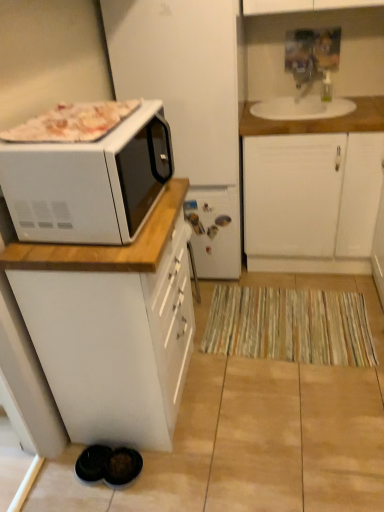
Measure the distance between point (168, 29) and camera.

Point (168, 29) is 6.19 feet from camera.

The image size is (384, 512). What do you see at coordinates (319, 121) in the screenshot?
I see `wooden countertop at upper right` at bounding box center [319, 121].

Measure the distance between point (263, 326) and camera.

Point (263, 326) and camera are 2.20 meters apart from each other.

Describe the element at coordinates (310, 189) in the screenshot. The image size is (384, 512). I see `white matte cabinet at upper right, the second cabinetry from the front` at that location.

Where is `white glossy microwave at upper left`? This screenshot has height=512, width=384. white glossy microwave at upper left is located at coordinates (89, 182).

This screenshot has width=384, height=512. Identify the location of white matte microwave at left. (189, 105).

Could you tell me if striped fabric mat at lower center is facing white matte microwave at left?

No, striped fabric mat at lower center is not facing towards white matte microwave at left.

Is the position of striped fabric mat at lower center more distant than that of white matte microwave at left?

Yes, it is behind white matte microwave at left.

Is striped fabric mat at lower center to the left of white matte microwave at left from the viewer's perspective?

Incorrect, striped fabric mat at lower center is not on the left side of white matte microwave at left.

Can you tell me how much striped fabric mat at lower center and white matte microwave at left differ in facing direction?

The angle between the facing direction of striped fabric mat at lower center and the facing direction of white matte microwave at left is 2.92 degrees.

Is white matte cabinet at left, the 2th cabinetry positioned from the right, wider than white matte microwave at left?

No.

Consider the image. From the image's perspective, which object appears higher, white matte cabinet at left, the 2th cabinetry positioned from the right, or white matte microwave at left?

white matte microwave at left, from the image's perspective.

Find the location of a particular element. The width and height of the screenshot is (384, 512). cabinetry to the left of white matte microwave at left is located at coordinates (113, 326).

Consider the image. Is white matte cabinet at left, positioned as the 2th cabinetry in back-to-front order, at the left side of white matte microwave at left?

Indeed, white matte cabinet at left, positioned as the 2th cabinetry in back-to-front order, is positioned on the left side of white matte microwave at left.

From a real-world perspective, is wooden countertop at upper right below white matte cabinet at left, the 2th cabinetry positioned from the right?

Actually, wooden countertop at upper right is physically above white matte cabinet at left, the 2th cabinetry positioned from the right, in the real world.

Considering the positions of points (374, 113) and (66, 326), is point (374, 113) farther from camera compared to point (66, 326)?

Yes.

You are a GUI agent. You are given a task and a screenshot of the screen. Output one action in this format:
    pyautogui.click(x=<x>, y=<y>)
    Task: Click on the countertop positioned vertically above the white matte cabinet at left, positioned as the 2th cabinetry in back-to-front order (from a real-world perspective)
    
    Given the screenshot: What is the action you would take?
    pyautogui.click(x=319, y=121)

Can you see wooden countertop at upper right touching white matte cabinet at left, the 2th cabinetry positioned from the right?

No, wooden countertop at upper right is not touching white matte cabinet at left, the 2th cabinetry positioned from the right.

Consider the image. Is white matte cabinet at left, acting as the 1th cabinetry starting from the front, wider than white glossy microwave at upper left?

Correct, the width of white matte cabinet at left, acting as the 1th cabinetry starting from the front, exceeds that of white glossy microwave at upper left.

Which of these two, white matte cabinet at left, marked as the first cabinetry in a left-to-right arrangement, or white glossy microwave at upper left, stands taller?

white matte cabinet at left, marked as the first cabinetry in a left-to-right arrangement, is taller.

Is white matte cabinet at left, positioned as the 2th cabinetry in back-to-front order, with white glossy microwave at upper left?

No, white matte cabinet at left, positioned as the 2th cabinetry in back-to-front order, is not making contact with white glossy microwave at upper left.

From the image's perspective, is white matte cabinet at left, acting as the 1th cabinetry starting from the front, positioned above or below white glossy microwave at upper left?

white matte cabinet at left, acting as the 1th cabinetry starting from the front, is situated lower than white glossy microwave at upper left in the image.

Which object is wider, white matte cabinet at upper right, the second cabinetry viewed from the left, or white matte cabinet at left, positioned as the 2th cabinetry in back-to-front order?

With larger width is white matte cabinet at upper right, the second cabinetry viewed from the left.

Which is more to the left, white matte cabinet at upper right, the second cabinetry from the front, or white matte cabinet at left, marked as the first cabinetry in a left-to-right arrangement?

white matte cabinet at left, marked as the first cabinetry in a left-to-right arrangement.

From the image's perspective, which object appears higher, white matte cabinet at upper right, the 1th cabinetry viewed from the right, or white matte cabinet at left, acting as the 1th cabinetry starting from the front?

From the image's view, white matte cabinet at upper right, the 1th cabinetry viewed from the right, is above.

In the scene shown: Who is taller, white matte cabinet at upper right, the first cabinetry in the back-to-front sequence, or white matte cabinet at left, positioned as the 2th cabinetry in back-to-front order?

white matte cabinet at upper right, the first cabinetry in the back-to-front sequence, is taller.

From the image's perspective, would you say wooden countertop at upper right is shown under white matte microwave at left?

→ Actually, wooden countertop at upper right appears above white matte microwave at left in the image.

Does wooden countertop at upper right have a lesser width compared to white matte microwave at left?

Yes, wooden countertop at upper right is thinner than white matte microwave at left.

From their relative heights in the image, would you say wooden countertop at upper right is taller or shorter than white matte microwave at left?

Clearly, wooden countertop at upper right is shorter compared to white matte microwave at left.

The image size is (384, 512). Find the location of `appliance lying below the wooden countertop at upper right (from the image's perspective)`. appliance lying below the wooden countertop at upper right (from the image's perspective) is located at coordinates (189, 105).

From a real-world perspective, is white glossy microwave at upper left on top of wooden countertop at upper right?

Yes, from a real-world perspective, white glossy microwave at upper left is above wooden countertop at upper right.

Is white glossy microwave at upper left taller or shorter than wooden countertop at upper right?

Clearly, white glossy microwave at upper left is taller compared to wooden countertop at upper right.

Could you tell me if white glossy microwave at upper left is facing wooden countertop at upper right?

No, white glossy microwave at upper left is not turned towards wooden countertop at upper right.

What's the angular difference between white glossy microwave at upper left and wooden countertop at upper right's facing directions?

There is a 87.4-degree angle between the facing directions of white glossy microwave at upper left and wooden countertop at upper right.

Image resolution: width=384 pixels, height=512 pixels. In the image, there is a white matte microwave at left. Find the location of `mat below it (from the image's perspective)`. mat below it (from the image's perspective) is located at coordinates (290, 325).

Where is `appliance that is on the right side of white matte cabinet at left, positioned as the 2th cabinetry in back-to-front order`? The height and width of the screenshot is (512, 384). appliance that is on the right side of white matte cabinet at left, positioned as the 2th cabinetry in back-to-front order is located at coordinates (189, 105).

When comparing their distances from white matte cabinet at left, positioned as the 2th cabinetry in back-to-front order, does white glossy microwave at upper left or white matte cabinet at upper right, the first cabinetry in the back-to-front sequence, seem further?

white matte cabinet at upper right, the first cabinetry in the back-to-front sequence, is further to white matte cabinet at left, positioned as the 2th cabinetry in back-to-front order.

Considering their positions, is white glossy microwave at upper left positioned further to striped fabric mat at lower center than white matte cabinet at upper right, the first cabinetry in the back-to-front sequence?

white glossy microwave at upper left is positioned further to the anchor striped fabric mat at lower center.

When comparing their distances from wooden countertop at upper right, does striped fabric mat at lower center or white matte microwave at left seem further?

Among the two, striped fabric mat at lower center is located further to wooden countertop at upper right.

Considering their positions, is striped fabric mat at lower center positioned closer to white matte microwave at left than white matte cabinet at left, marked as the first cabinetry in a left-to-right arrangement?

striped fabric mat at lower center.

When comparing their distances from striped fabric mat at lower center, does white glossy microwave at upper left or white matte cabinet at left, positioned as the 2th cabinetry in back-to-front order, seem further?

white glossy microwave at upper left is positioned further to the anchor striped fabric mat at lower center.

From the image, which object appears to be nearer to striped fabric mat at lower center, white matte cabinet at upper right, the second cabinetry viewed from the left, or white matte microwave at left?

Based on the image, white matte cabinet at upper right, the second cabinetry viewed from the left, appears to be nearer to striped fabric mat at lower center.

When comparing their distances from striped fabric mat at lower center, does white matte cabinet at upper right, the second cabinetry from the front, or white matte cabinet at left, acting as the 1th cabinetry starting from the front, seem closer?

The object closer to striped fabric mat at lower center is white matte cabinet at upper right, the second cabinetry from the front.

Estimate the real-world distances between objects in this image. Which object is closer to white glossy microwave at upper left, striped fabric mat at lower center or white matte microwave at left?

white matte microwave at left lies closer to white glossy microwave at upper left than the other object.

I want to click on appliance between wooden countertop at upper right and striped fabric mat at lower center in the vertical direction, so click(x=189, y=105).

Where is `cabinetry located between white glossy microwave at upper left and white matte cabinet at upper right, the 1th cabinetry viewed from the right, in the left-right direction`? The image size is (384, 512). cabinetry located between white glossy microwave at upper left and white matte cabinet at upper right, the 1th cabinetry viewed from the right, in the left-right direction is located at coordinates (113, 326).

Identify the location of cabinetry between white glossy microwave at upper left and striped fabric mat at lower center from front to back. (113, 326).

Find the location of a particular element. The image size is (384, 512). countertop between white matte cabinet at left, positioned as the 2th cabinetry in back-to-front order, and white matte cabinet at upper right, the first cabinetry in the back-to-front sequence is located at coordinates (319, 121).